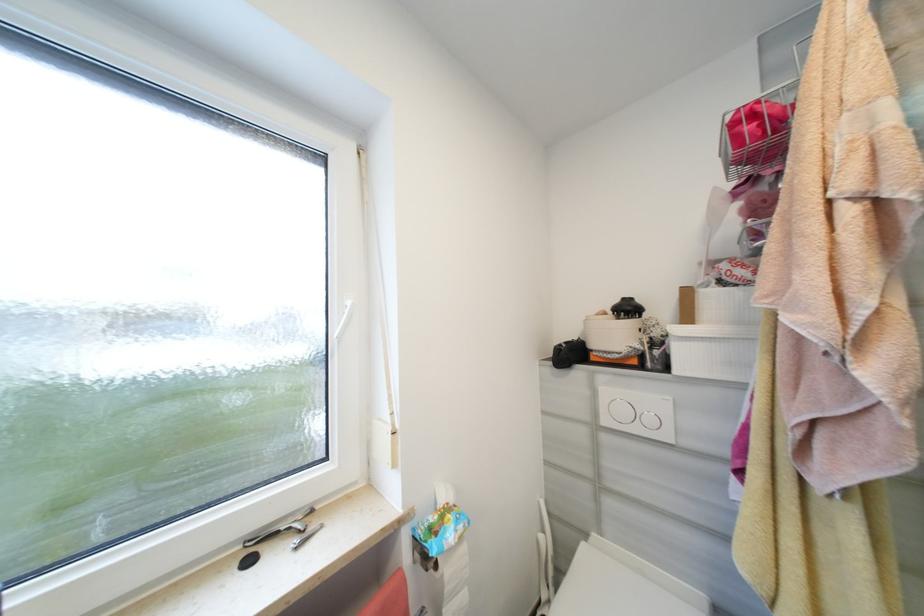
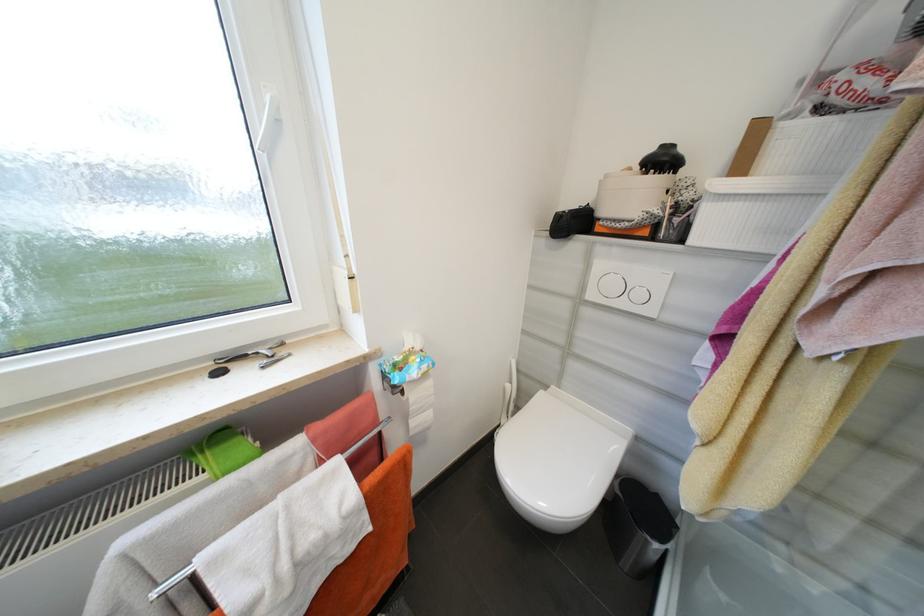
The point at (x=655, y=421) is marked in the first image. Where is the corresponding point in the second image?

(646, 296)